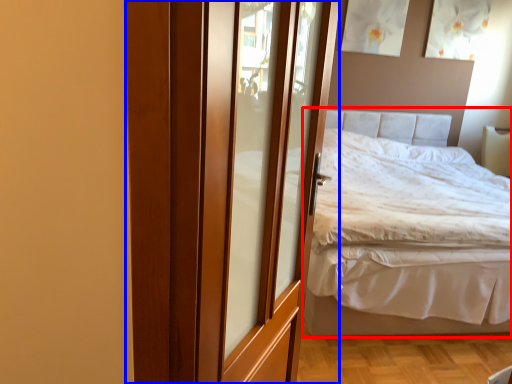
Question: Which object is closer to the camera taking this photo, bed (highlighted by a red box) or door (highlighted by a blue box)?

Choices:
 (A) bed
 (B) door

Answer: (B)